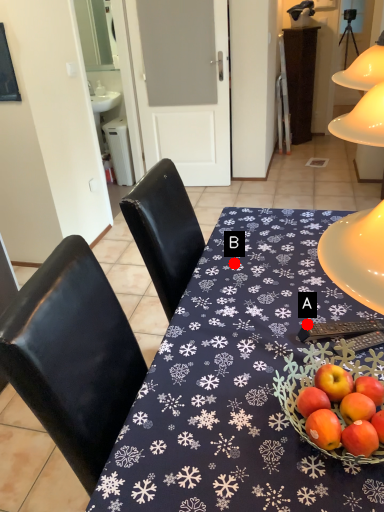
Question: Two points are circled on the image, labeled by A and B beside each circle. Which point appears farthest from the camera in this image?

Choices:
 (A) A is further
 (B) B is further

Answer: (B)